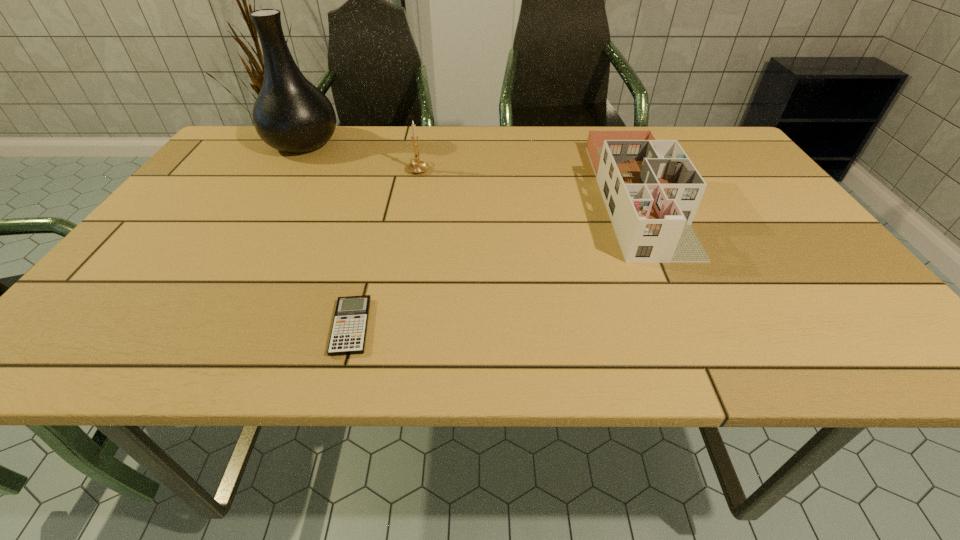
Where is `blank region between the third object from right to left and the second object from right to left`? blank region between the third object from right to left and the second object from right to left is located at coordinates click(385, 247).

Image resolution: width=960 pixels, height=540 pixels. What are the coordinates of `free space between the tallest object and the second shortest object` in the screenshot? It's located at (470, 170).

At what (x,y) coordinates should I click in order to perform the action: click on vacant point located between the vase and the third object from left to right. Please return your answer as a coordinate pair (x, y). Looking at the image, I should click on (361, 156).

Find the location of a particular element. The image size is (960, 540). free area in between the rightmost object and the third shortest object is located at coordinates (528, 183).

Identify the location of free point between the shortest object and the dollhouse. (494, 261).

The image size is (960, 540). I want to click on free space that is in between the leftmost object and the candle holder, so click(x=361, y=156).

Identify which object is the nearest to the second shortest object. Please provide its 2D coordinates. Your answer should be formatted as a tuple, i.e. [(x, y)], where the tuple contains the x and y coordinates of a point satisfying the conditions above.

[(416, 166)]

Where is `the third closest object to the vase`? the third closest object to the vase is located at coordinates (651, 189).